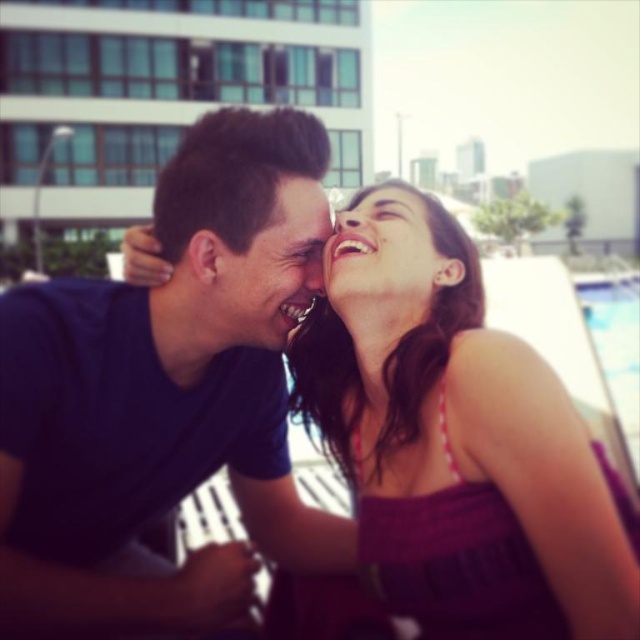
Question: Which point is closer to the camera?

Choices:
 (A) (476, 266)
 (B) (278, 225)
 (C) (221, 252)

Answer: (C)

Question: Estimate the real-world distances between objects in this image. Which object is closer to the matte purple dress at center?

Choices:
 (A) purple knit dress at center
 (B) matte black forehead at upper center

Answer: (A)

Question: In this image, where is purple knit dress at center located relative to matte purple dress at center?

Choices:
 (A) below
 (B) above

Answer: (A)

Question: Does matte black face at center appear on the right side of matte black forehead at upper center?

Choices:
 (A) yes
 (B) no

Answer: (B)

Question: Which point is closer to the camera?

Choices:
 (A) matte black face at center
 (B) matte black forehead at upper center

Answer: (A)

Question: Is purple knit dress at center smaller than matte black face at center?

Choices:
 (A) no
 (B) yes

Answer: (A)